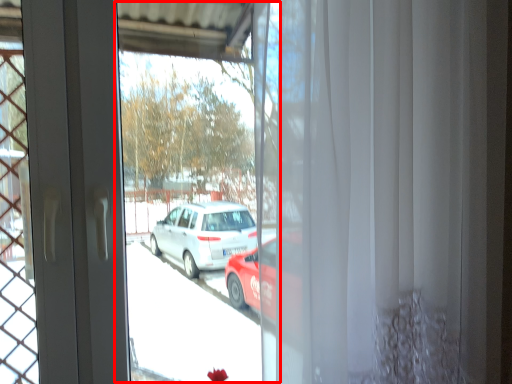
Question: From the image's perspective, what is the correct spatial relationship of shop window (annotated by the red box) in relation to curtain?

Choices:
 (A) below
 (B) above

Answer: (A)